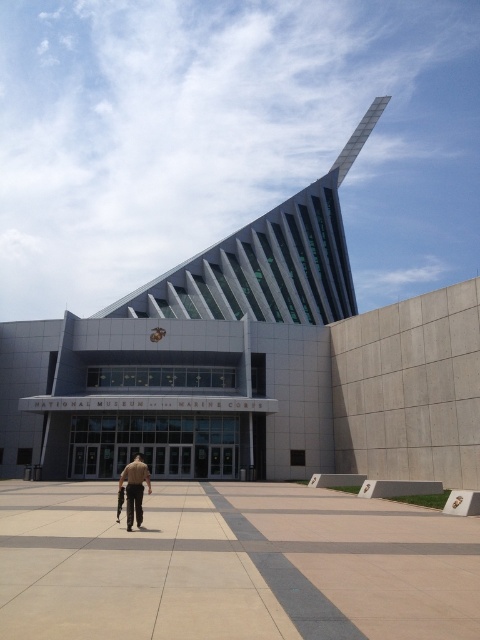
Question: Among these points, which one is nearest to the camera?

Choices:
 (A) 128,508
 (B) 177,568

Answer: (B)

Question: Is beige concrete pavement at center thinner than tan uniform at center?

Choices:
 (A) no
 (B) yes

Answer: (A)

Question: Which point is farther to the camera?

Choices:
 (A) (331, 522)
 (B) (142, 515)

Answer: (A)

Question: Which of the following is the closest to the observer?

Choices:
 (A) (141, 502)
 (B) (124, 582)

Answer: (B)

Question: Is beige concrete pavement at center positioned at the back of tan uniform at center?

Choices:
 (A) yes
 (B) no

Answer: (B)

Question: Can you confirm if beige concrete pavement at center is thinner than tan uniform at center?

Choices:
 (A) yes
 (B) no

Answer: (B)